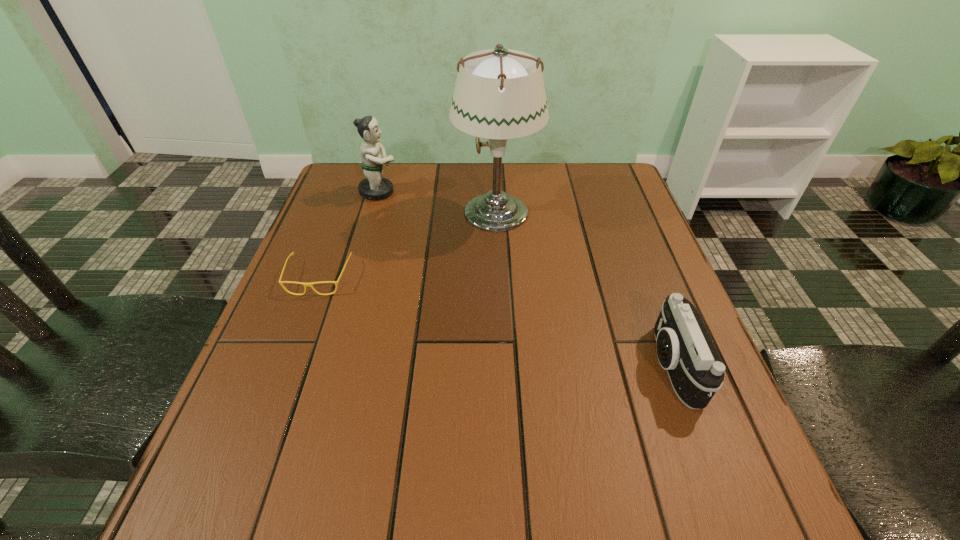
Image resolution: width=960 pixels, height=540 pixels. In order to click on vacant space situated on the front-facing side of the figurine in this screenshot , I will do `click(449, 192)`.

At what (x,y) coordinates should I click in order to perform the action: click on vacant point located 0.320m on the front lens of the nearest object. Please return your answer as a coordinate pair (x, y). Image resolution: width=960 pixels, height=540 pixels. Looking at the image, I should click on (476, 366).

The width and height of the screenshot is (960, 540). In order to click on vacant space positioned on the front lens of the nearest object in this screenshot , I will do `click(509, 366)`.

The width and height of the screenshot is (960, 540). I want to click on free space located on the front lens of the nearest object, so click(444, 366).

You are a GUI agent. You are given a task and a screenshot of the screen. Output one action in this format:
    pyautogui.click(x=<x>, y=<y>)
    Task: Click on the vacant space located 0.330m in front of the lenses of the shortest object
    This screenshot has height=540, width=960.
    Given the screenshot: What is the action you would take?
    pyautogui.click(x=255, y=447)

Image resolution: width=960 pixels, height=540 pixels. I want to click on lampshade that is at the far edge, so click(x=499, y=94).

Locate an element on the screen. figurine present at the far edge is located at coordinates (374, 187).

Locate an element on the screen. The height and width of the screenshot is (540, 960). figurine at the left edge is located at coordinates (374, 187).

Find the location of a particular element. This screenshot has height=540, width=960. spectacles present at the left edge is located at coordinates (280, 282).

Locate an element on the screen. The height and width of the screenshot is (540, 960). object that is at the right edge is located at coordinates pyautogui.click(x=684, y=348).